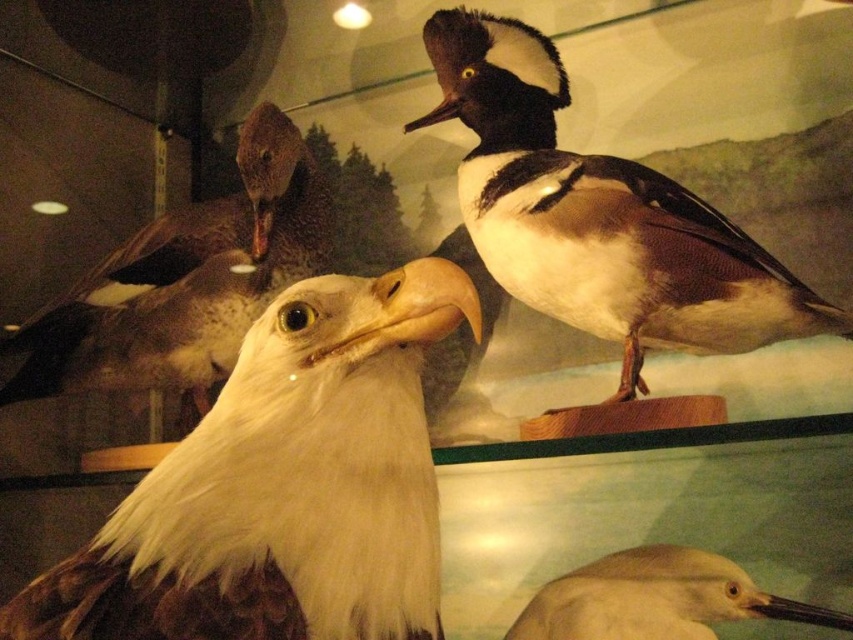
Is point (326, 540) closer to viewer compared to point (273, 136)?

That is True.

Does white feathered eagle at center appear on the right side of white matte bald eagle at upper left?

Correct, you'll find white feathered eagle at center to the right of white matte bald eagle at upper left.

Between point (387, 417) and point (193, 259), which one is positioned in front?

Positioned in front is point (387, 417).

Find the location of `white feathered eagle at center`. white feathered eagle at center is located at coordinates (x=283, y=486).

Is brown-feathered duck at upper right wider than white matte bald eagle at upper left?

Yes, brown-feathered duck at upper right is wider than white matte bald eagle at upper left.

Who is higher up, brown-feathered duck at upper right or white matte bald eagle at upper left?

brown-feathered duck at upper right is above.

Between point (746, 289) and point (276, 193), which one is positioned in front?

Point (746, 289) is more forward.

The height and width of the screenshot is (640, 853). I want to click on brown-feathered duck at upper right, so click(599, 216).

Is white matte bald eagle at upper left shorter than white matte snowy egret at lower right?

Incorrect, white matte bald eagle at upper left's height does not fall short of white matte snowy egret at lower right's.

Does white matte bald eagle at upper left lie in front of white matte snowy egret at lower right?

No, it is not.

The height and width of the screenshot is (640, 853). What do you see at coordinates (184, 282) in the screenshot? I see `white matte bald eagle at upper left` at bounding box center [184, 282].

The width and height of the screenshot is (853, 640). I want to click on white matte bald eagle at upper left, so click(184, 282).